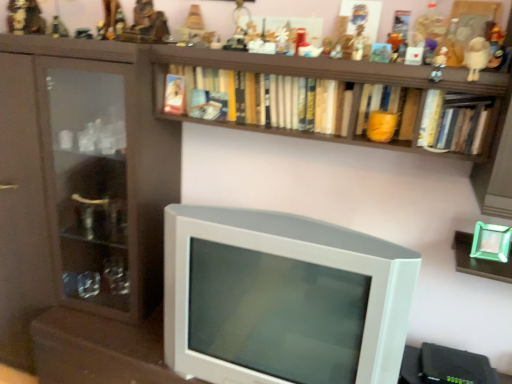
Describe the element at coordinates (300, 40) in the screenshot. I see `matte plastic toy at upper center, marked as the 4th toy in a right-to-left arrangement` at that location.

Measure the distance between point (186, 76) and camera.

Point (186, 76) is 5.03 feet from camera.

This screenshot has width=512, height=384. What do you see at coordinates (390, 111) in the screenshot?
I see `orange matte book at center, acting as the second book starting from the right` at bounding box center [390, 111].

Describe the element at coordinates (497, 59) in the screenshot. Image resolution: width=512 pixels, height=384 pixels. I see `white plastic figurine at upper right, placed as the first toy when sorted from right to left` at that location.

In order to face white plush toy at upper right, which is counted as the 2th toy, starting from the right, should I rotate leftwards or rightwards?

Turn right by 27.406 degrees to look at white plush toy at upper right, which is counted as the 2th toy, starting from the right.

What do you see at coordinates (241, 18) in the screenshot? I see `metallic silver toy at upper center, which ranks as the 5th toy in right-to-left order` at bounding box center [241, 18].

The image size is (512, 384). I want to click on matte plastic toy at upper center, which appears as the eighth toy when viewed from the left, so click(300, 40).

In terms of width, does white plastic figurine at upper right, which appears as the eleventh toy when viewed from the left, look wider or thinner when compared to matte brown statue at upper center, the 6th toy positioned from the left?

white plastic figurine at upper right, which appears as the eleventh toy when viewed from the left, is thinner than matte brown statue at upper center, the 6th toy positioned from the left.

From the image's perspective, is white plastic figurine at upper right, placed as the first toy when sorted from right to left, on matte brown statue at upper center, the 6th toy positioned from the left?

No, from the image's perspective, white plastic figurine at upper right, placed as the first toy when sorted from right to left, is not on top of matte brown statue at upper center, the 6th toy positioned from the left.

From a real-world perspective, between white plastic figurine at upper right, placed as the first toy when sorted from right to left, and matte brown statue at upper center, the 6th toy positioned from the left, who is vertically higher?

matte brown statue at upper center, the 6th toy positioned from the left, from a real-world perspective.

Does white plastic figurine at upper right, which appears as the eleventh toy when viewed from the left, have a smaller size compared to matte brown statue at upper center, the 6th toy positioned from the left?

Yes.

Locate an element on the screen. Image resolution: width=512 pixels, height=384 pixels. toy that is the 4th one when counting upward from the orange matte book at center, acting as the second book starting from the right (from the image's perspective) is located at coordinates (300, 40).

Is orange matte book at center, acting as the second book starting from the right, closer to the viewer compared to matte plastic toy at upper center, which appears as the eighth toy when viewed from the left?

Yes, orange matte book at center, acting as the second book starting from the right, is closer to the viewer.

Would you say orange matte book at center, acting as the second book starting from the right, is to the left or to the right of matte plastic toy at upper center, marked as the 4th toy in a right-to-left arrangement, in the picture?

Based on their positions, orange matte book at center, acting as the second book starting from the right, is located to the right of matte plastic toy at upper center, marked as the 4th toy in a right-to-left arrangement.

Is orange matte book at center, the second book viewed from the left, not close to matte plastic toy at upper center, which appears as the eighth toy when viewed from the left?

No.

How distant is matte brown statue at upper center, the 6th toy positioned from the left, from metallic figurine at upper center, positioned as the fourth toy in left-to-right order?

The distance of matte brown statue at upper center, the 6th toy positioned from the left, from metallic figurine at upper center, positioned as the fourth toy in left-to-right order, is 4.05 inches.

Can we say matte brown statue at upper center, the 6th toy positioned from the left, lies outside metallic figurine at upper center, positioned as the fourth toy in left-to-right order?

Yes, matte brown statue at upper center, the 6th toy positioned from the left, is not within metallic figurine at upper center, positioned as the fourth toy in left-to-right order.

Which is closer to the camera, (165, 17) or (105, 10)?

The point (165, 17) is closer.

Are matte brown statue at upper center, placed as the 6th toy when sorted from right to left, and metallic figurine at upper center, positioned as the fourth toy in left-to-right order, far apart?

They are positioned close to each other.

Looking at this image, considering the relative sizes of white plush toy at upper right, which is counted as the 2th toy, starting from the right, and hardcover book at upper right, the first book from the right, in the image provided, is white plush toy at upper right, which is counted as the 2th toy, starting from the right, smaller than hardcover book at upper right, the first book from the right,?

Indeed, white plush toy at upper right, which is counted as the 2th toy, starting from the right, has a smaller size compared to hardcover book at upper right, the first book from the right.

In terms of height, does white plush toy at upper right, which is counted as the 2th toy, starting from the right, look taller or shorter compared to hardcover book at upper right, acting as the 3th book starting from the left?

Clearly, white plush toy at upper right, which is counted as the 2th toy, starting from the right, is shorter compared to hardcover book at upper right, acting as the 3th book starting from the left.

Is white plush toy at upper right, which is counted as the 2th toy, starting from the right, oriented away from hardcover book at upper right, the first book from the right?

No, white plush toy at upper right, which is counted as the 2th toy, starting from the right, is not facing away from hardcover book at upper right, the first book from the right.

From a real-world perspective, is white plush toy at upper right, which is counted as the 2th toy, starting from the right, positioned above or below hardcover book at upper right, acting as the 3th book starting from the left?

white plush toy at upper right, which is counted as the 2th toy, starting from the right, is situated higher than hardcover book at upper right, acting as the 3th book starting from the left, in the real world.

Is point (57, 30) more distant than point (190, 274)?

Yes, point (57, 30) is farther from viewer.

In the image, is metallic gold figurine at upper center, the 2th toy positioned from the left, positioned in front of or behind white plastic television at center?

Clearly, metallic gold figurine at upper center, the 2th toy positioned from the left, is behind white plastic television at center.

Is metallic gold figurine at upper center, the 2th toy positioned from the left, inside or outside of white plastic television at center?

metallic gold figurine at upper center, the 2th toy positioned from the left, cannot be found inside white plastic television at center.

From a real-world perspective, which object rests below the other?

white plastic television at center, from a real-world perspective.

In the scene shown: How far apart are white plastic figurine at upper right, placed as the first toy when sorted from right to left, and metallic figurine at upper center, positioned as the fourth toy in left-to-right order?

They are 1.27 meters apart.

Can you tell me how much white plastic figurine at upper right, which appears as the eleventh toy when viewed from the left, and metallic figurine at upper center, placed as the eighth toy when sorted from right to left, differ in facing direction?

The angle between the facing direction of white plastic figurine at upper right, which appears as the eleventh toy when viewed from the left, and the facing direction of metallic figurine at upper center, placed as the eighth toy when sorted from right to left, is 9.1 degrees.

From the image's perspective, relative to metallic figurine at upper center, placed as the eighth toy when sorted from right to left, is white plastic figurine at upper right, placed as the first toy when sorted from right to left, above or below?

white plastic figurine at upper right, placed as the first toy when sorted from right to left, is below metallic figurine at upper center, placed as the eighth toy when sorted from right to left.

Is white plastic figurine at upper right, placed as the first toy when sorted from right to left, to the right of metallic figurine at upper center, placed as the eighth toy when sorted from right to left, from the viewer's perspective?

Indeed, white plastic figurine at upper right, placed as the first toy when sorted from right to left, is positioned on the right side of metallic figurine at upper center, placed as the eighth toy when sorted from right to left.

From a real-world perspective, who is located lower, matte plastic toy at upper center, marked as the 4th toy in a right-to-left arrangement, or metallic gold figurine at upper center, which ranks as the seventh toy in right-to-left order?

From a 3D spatial view, matte plastic toy at upper center, marked as the 4th toy in a right-to-left arrangement, is below.

How much distance is there between matte plastic toy at upper center, which appears as the eighth toy when viewed from the left, and metallic gold figurine at upper center, which appears as the 5th toy when viewed from the left?

They are 25.19 inches apart.

Considering the relative sizes of matte plastic toy at upper center, marked as the 4th toy in a right-to-left arrangement, and metallic gold figurine at upper center, which ranks as the seventh toy in right-to-left order, in the image provided, is matte plastic toy at upper center, marked as the 4th toy in a right-to-left arrangement, smaller than metallic gold figurine at upper center, which ranks as the seventh toy in right-to-left order,?

Indeed, matte plastic toy at upper center, marked as the 4th toy in a right-to-left arrangement, has a smaller size compared to metallic gold figurine at upper center, which ranks as the seventh toy in right-to-left order.

In order to click on the 3rd toy behind the white plastic figurine at upper right, placed as the first toy when sorted from right to left in this screenshot , I will do `click(147, 24)`.

Find the location of `toy that is the 2nd object to the left of the orange matte book at center, acting as the second book starting from the right, starting at the anchor`. toy that is the 2nd object to the left of the orange matte book at center, acting as the second book starting from the right, starting at the anchor is located at coordinates [300, 40].

When comparing their distances from hardcover book at upper right, acting as the 3th book starting from the left, does orange matte book at center, acting as the second book starting from the right, or matte plastic figurine at upper center, marked as the third toy in a right-to-left arrangement, seem further?

The object further to hardcover book at upper right, acting as the 3th book starting from the left, is matte plastic figurine at upper center, marked as the third toy in a right-to-left arrangement.

Estimate the real-world distances between objects in this image. Which object is closer to matte plastic toy at upper center, which appears as the eighth toy when viewed from the left, metallic gold figurine at upper left, acting as the 1th toy starting from the left, or metallic figurine at upper center, the ninth toy from the right?

metallic figurine at upper center, the ninth toy from the right, lies closer to matte plastic toy at upper center, which appears as the eighth toy when viewed from the left, than the other object.

Which object lies nearer to the anchor point metallic silver toy at upper center, which ranks as the 5th toy in right-to-left order, hardcover book at upper right, the first book from the right, or metallic figurine at upper center, the third toy viewed from the left?

The object closer to metallic silver toy at upper center, which ranks as the 5th toy in right-to-left order, is metallic figurine at upper center, the third toy viewed from the left.

Estimate the real-world distances between objects in this image. Which object is closer to metallic figurine at upper center, the third toy viewed from the left, white plastic figurine at upper right, placed as the first toy when sorted from right to left, or matte plastic figurine at upper center, marked as the third toy in a right-to-left arrangement?

matte plastic figurine at upper center, marked as the third toy in a right-to-left arrangement.

Looking at the image, which one is located closer to hardcover books at upper center, acting as the 3th book starting from the right, white plastic figurine at upper right, placed as the first toy when sorted from right to left, or metallic figurine at upper center, placed as the eighth toy when sorted from right to left?

metallic figurine at upper center, placed as the eighth toy when sorted from right to left, is closer to hardcover books at upper center, acting as the 3th book starting from the right.

Looking at the image, which one is located further to white plush toy at upper right, positioned as the 10th toy in left-to-right order, matte plastic toy at upper center, which appears as the eighth toy when viewed from the left, or metallic gold figurine at upper left, which is the 11th toy from right to left?

metallic gold figurine at upper left, which is the 11th toy from right to left, is positioned further to the anchor white plush toy at upper right, positioned as the 10th toy in left-to-right order.

Based on their spatial positions, is metallic gold figurine at upper center, which appears as the 5th toy when viewed from the left, or metallic figurine at upper center, the ninth toy from the right, closer to hardcover book at upper right, the first book from the right?

Among the two, metallic gold figurine at upper center, which appears as the 5th toy when viewed from the left, is located nearer to hardcover book at upper right, the first book from the right.

From the image, which object appears to be farther from hardcover book at upper right, acting as the 3th book starting from the left, hardcover books at upper center, acting as the 3th book starting from the right, or white plush toy at upper right, which is counted as the 2th toy, starting from the right?

hardcover books at upper center, acting as the 3th book starting from the right.

The height and width of the screenshot is (384, 512). I want to click on book between metallic figurine at upper center, the ninth toy from the right, and orange matte book at center, the second book viewed from the left, from left to right, so click(259, 99).

Where is `television between metallic figurine at upper center, the third toy viewed from the left, and orange matte book at center, the second book viewed from the left, in the horizontal direction`? The image size is (512, 384). television between metallic figurine at upper center, the third toy viewed from the left, and orange matte book at center, the second book viewed from the left, in the horizontal direction is located at coordinates (282, 298).

Locate an element on the screen. book situated between metallic figurine at upper center, the ninth toy from the right, and matte plastic figurine at upper center, marked as the third toy in a right-to-left arrangement, from left to right is located at coordinates (259, 99).

In order to click on book between metallic gold figurine at upper center, the 2th toy positioned from the left, and matte plastic figurine at upper center, the ninth toy positioned from the left, from left to right in this screenshot , I will do `click(259, 99)`.